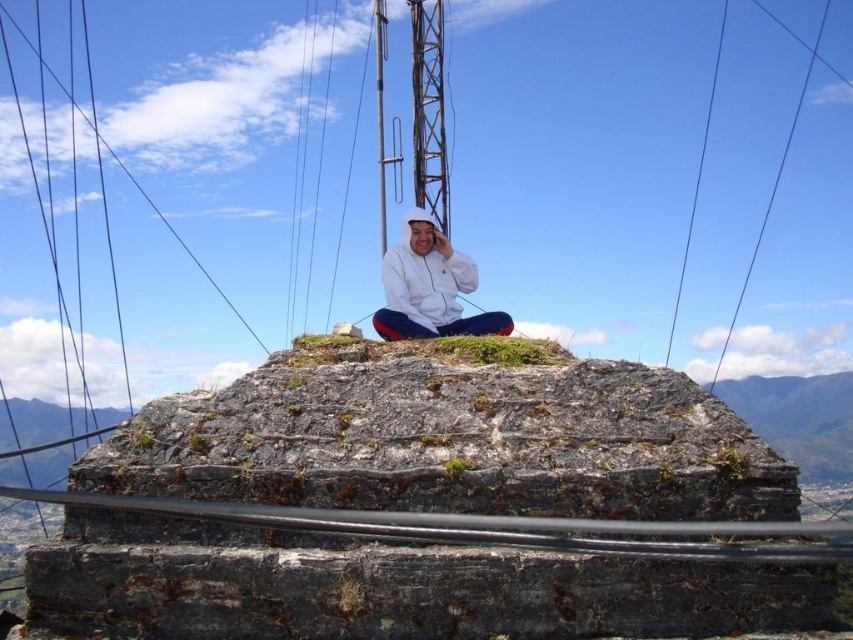
Question: Which object appears closest to the camera in this image?

Choices:
 (A) black wire at upper right
 (B) white matte jacket at center

Answer: (B)

Question: Can you confirm if white matte jacket at center is positioned below black wire at upper right?

Choices:
 (A) yes
 (B) no

Answer: (A)

Question: Can you confirm if white matte jacket at center is smaller than black wire at upper right?

Choices:
 (A) yes
 (B) no

Answer: (A)

Question: Is white matte jacket at center further to the viewer compared to black wire at upper right?

Choices:
 (A) yes
 (B) no

Answer: (B)

Question: Which of the following is the closest to the observer?

Choices:
 (A) white matte jacket at center
 (B) black wire at upper right

Answer: (A)